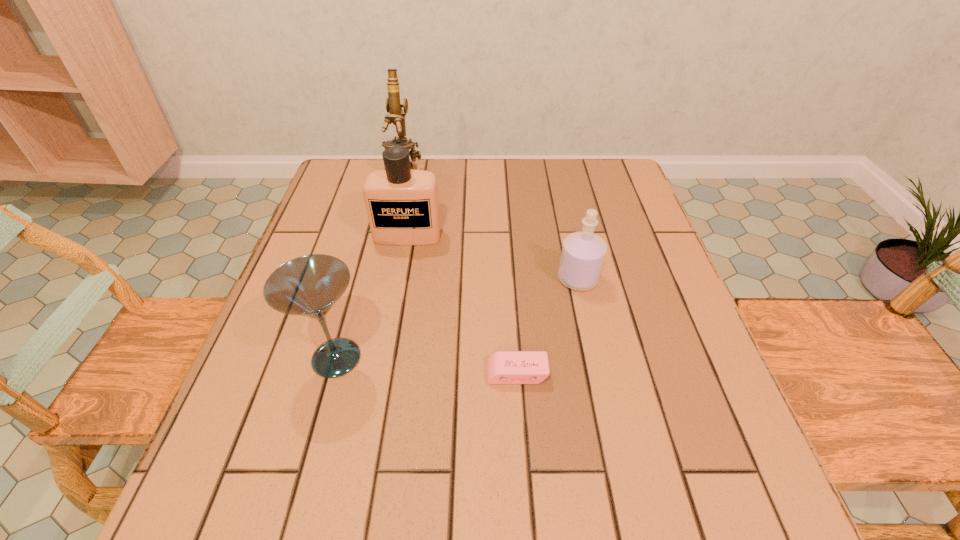
Where is `vacant point that satisfies the following two spatial constraints: 1. on the back side of the martini; 2. on the left side of the farthest object`? This screenshot has width=960, height=540. vacant point that satisfies the following two spatial constraints: 1. on the back side of the martini; 2. on the left side of the farthest object is located at coordinates (387, 173).